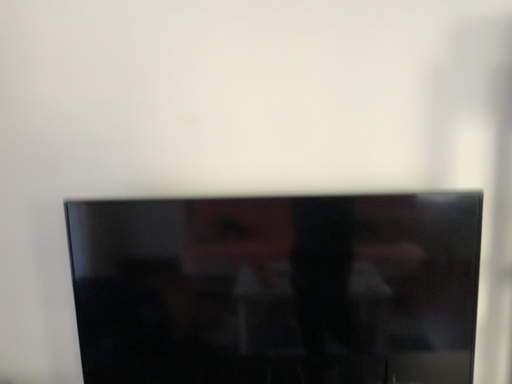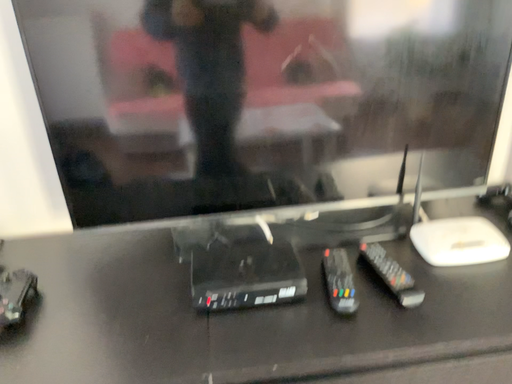
Question: Which way did the camera rotate in the video?

Choices:
 (A) rotated right
 (B) rotated left

Answer: (A)